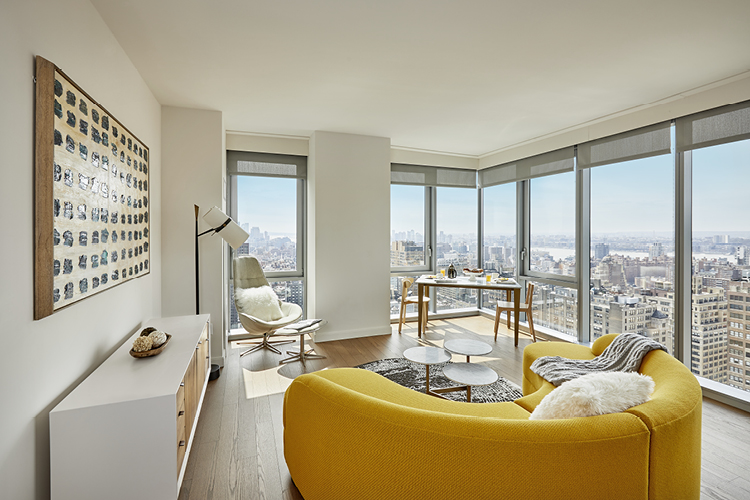
This screenshot has width=750, height=500. I want to click on table, so click(474, 287).